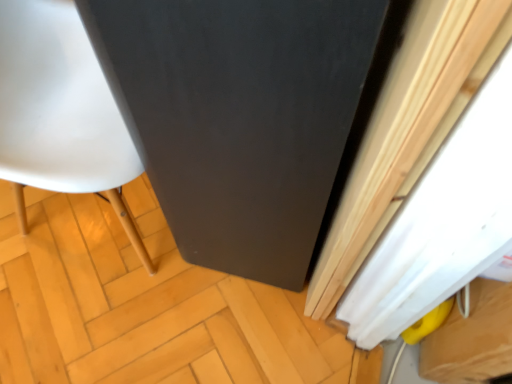
Question: Is matte black cabinet at center bigger than black matte screen door at center?

Choices:
 (A) yes
 (B) no

Answer: (B)

Question: Considering the relative sizes of matte black cabinet at center and black matte screen door at center in the image provided, is matte black cabinet at center thinner than black matte screen door at center?

Choices:
 (A) yes
 (B) no

Answer: (B)

Question: From the image's perspective, does matte black cabinet at center appear lower than black matte screen door at center?

Choices:
 (A) no
 (B) yes

Answer: (B)

Question: From a real-world perspective, is matte black cabinet at center physically below black matte screen door at center?

Choices:
 (A) no
 (B) yes

Answer: (B)

Question: Can you confirm if matte black cabinet at center is smaller than black matte screen door at center?

Choices:
 (A) no
 (B) yes

Answer: (B)

Question: Considering the positions of white matte curtain at right and matte black cabinet at center in the image, is white matte curtain at right taller or shorter than matte black cabinet at center?

Choices:
 (A) tall
 (B) short

Answer: (A)

Question: Considering their positions, is white matte curtain at right located in front of or behind matte black cabinet at center?

Choices:
 (A) behind
 (B) front

Answer: (B)

Question: From a real-world perspective, is white matte curtain at right above or below matte black cabinet at center?

Choices:
 (A) above
 (B) below

Answer: (A)

Question: Looking at their shapes, would you say white matte curtain at right is wider or thinner than matte black cabinet at center?

Choices:
 (A) wide
 (B) thin

Answer: (B)

Question: Is white matte curtain at right in front of or behind white glossy chair at left in the image?

Choices:
 (A) behind
 (B) front

Answer: (B)

Question: Is white matte curtain at right spatially inside white glossy chair at left, or outside of it?

Choices:
 (A) inside
 (B) outside

Answer: (B)

Question: Considering the positions of point (426, 69) and point (31, 52), is point (426, 69) closer or farther from the camera than point (31, 52)?

Choices:
 (A) farther
 (B) closer

Answer: (B)

Question: Looking at their shapes, would you say white matte curtain at right is wider or thinner than white glossy chair at left?

Choices:
 (A) thin
 (B) wide

Answer: (A)

Question: From the image's perspective, is matte black cabinet at center above or below white matte curtain at right?

Choices:
 (A) above
 (B) below

Answer: (B)

Question: Is matte black cabinet at center in front of or behind white matte curtain at right in the image?

Choices:
 (A) behind
 (B) front

Answer: (A)